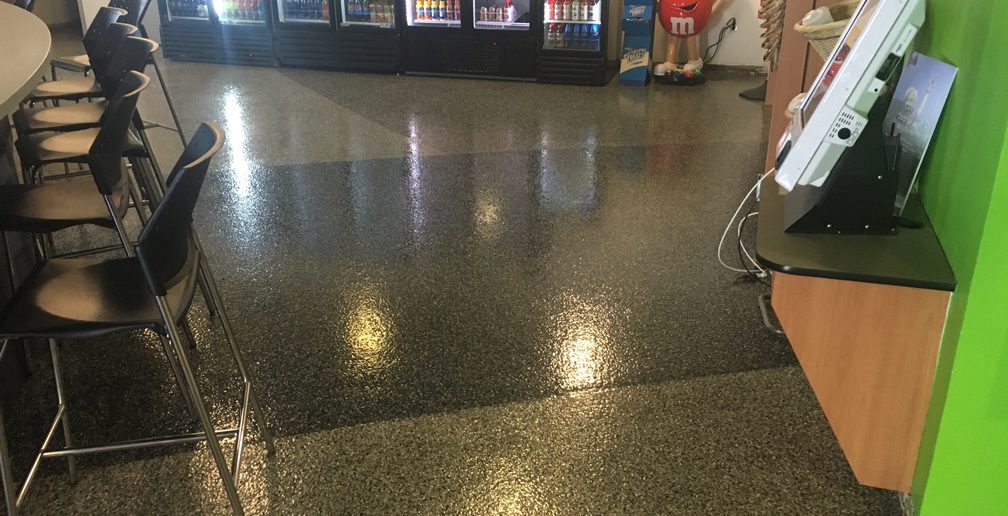
In order to click on green wall in this screenshot , I will do `click(976, 404)`.